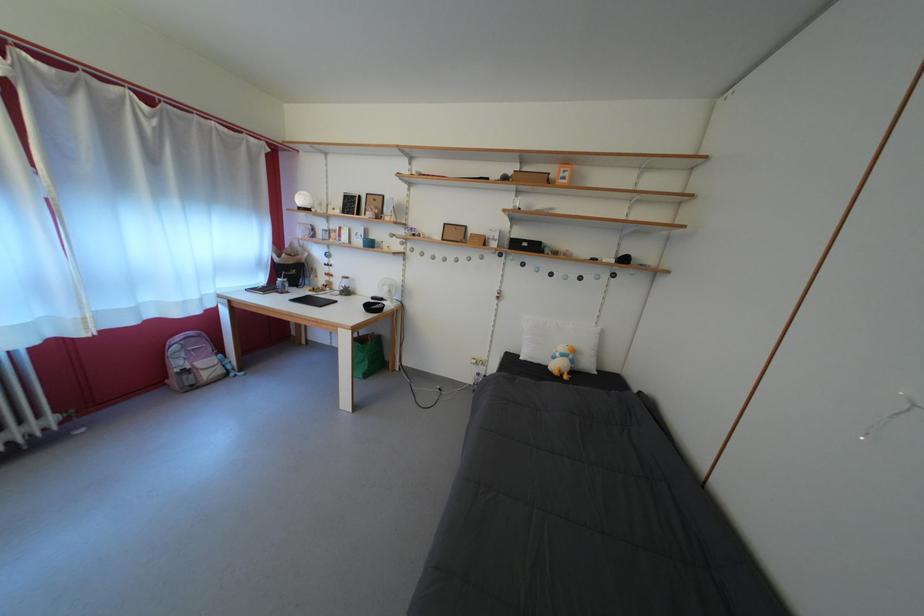
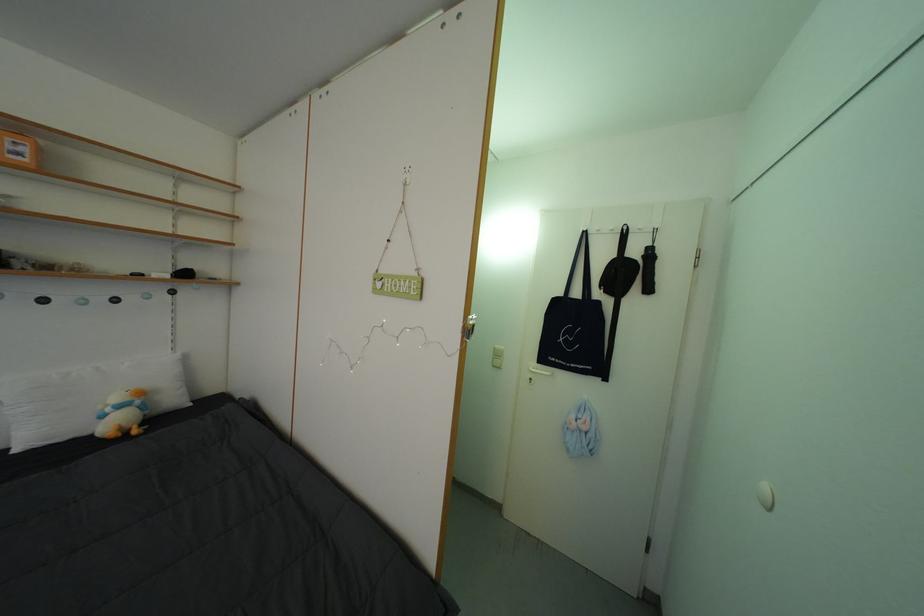
Where in the second image is the point corresponding to point (565, 361) from the first image?

(117, 415)